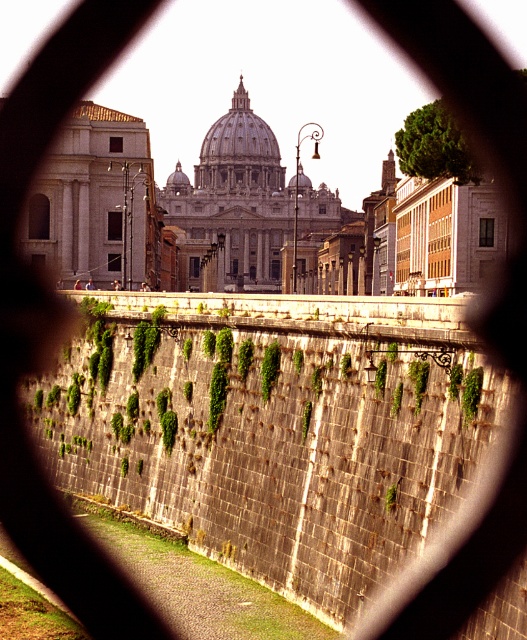
You are an architect analyzing the symmetry of the scene. Given that the green mossy stone wall at center and the white marble dome at center are key elements, which one appears narrower in the image?

The green mossy stone wall at center has a lesser width compared to the white marble dome at center, so it appears narrower.

You are an architect analyzing the symmetry of the scene. Considering the green mossy stone wall at center and the white marble dome at center, which one has a greater height?

The white marble dome at center is taller than the green mossy stone wall at center, so the dome has a greater height.